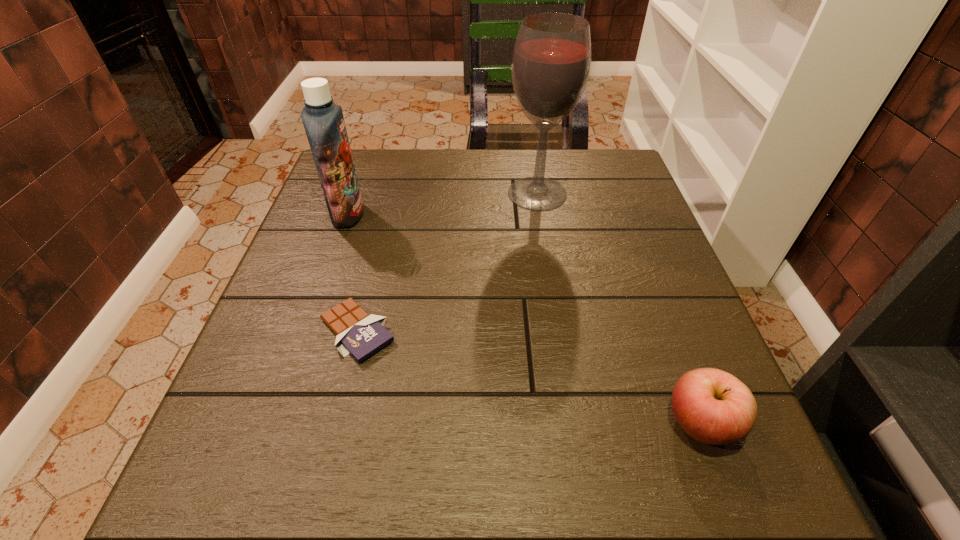
Locate an element on the screen. alcohol is located at coordinates (551, 63).

I want to click on the tallest object, so click(x=551, y=63).

Image resolution: width=960 pixels, height=540 pixels. Identify the location of shampoo. (323, 120).

The width and height of the screenshot is (960, 540). I want to click on the nearest object, so click(712, 406).

At what (x,y) coordinates should I click in order to perform the action: click on apple. Please return your answer as a coordinate pair (x, y). The width and height of the screenshot is (960, 540). Looking at the image, I should click on (712, 406).

Where is `the shortest object`? The width and height of the screenshot is (960, 540). the shortest object is located at coordinates (361, 335).

Locate an element on the screen. Image resolution: width=960 pixels, height=540 pixels. the second nearest object is located at coordinates (361, 335).

This screenshot has height=540, width=960. Identify the location of vacant space located 0.190m on the left of the alcohol. (433, 193).

This screenshot has height=540, width=960. Find the location of `blank space located 0.050m on the front label of the shampoo`. blank space located 0.050m on the front label of the shampoo is located at coordinates (384, 214).

Image resolution: width=960 pixels, height=540 pixels. Identify the location of vacant space located on the back of the second shortest object. (635, 247).